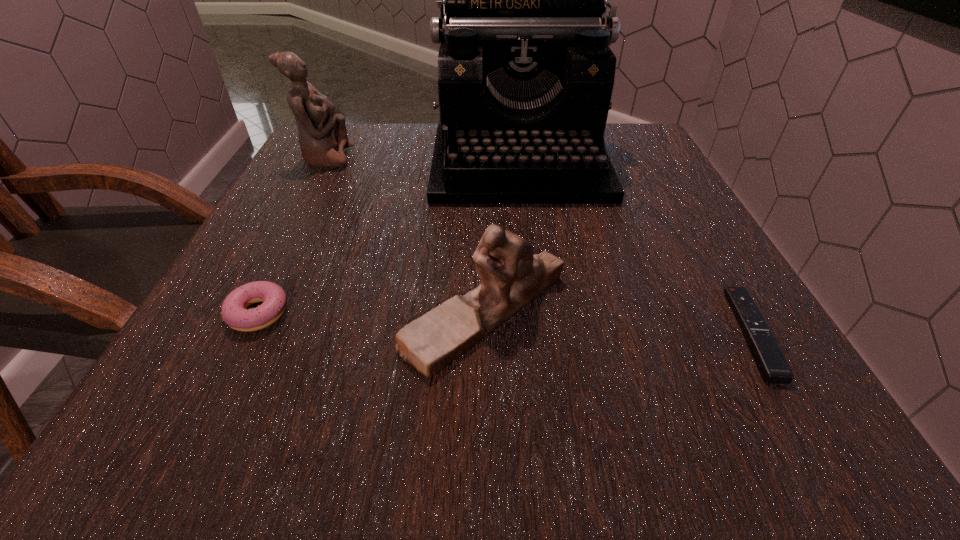
Where is `object that is the closest to the tallest object`? object that is the closest to the tallest object is located at coordinates (511, 276).

The width and height of the screenshot is (960, 540). I want to click on vacant space that satisfies the following two spatial constraints: 1. on the front-facing side of the taller figurine; 2. on the back side of the remote control, so click(232, 333).

This screenshot has height=540, width=960. Identify the location of blank area in the image that satisfies the following two spatial constraints: 1. on the front-facing side of the shorter figurine; 2. on the right side of the shortest object. (485, 333).

Where is `free spot that satisfies the following two spatial constraints: 1. on the back side of the shortest object; 2. on the front-facing side of the third tallest object`? The image size is (960, 540). free spot that satisfies the following two spatial constraints: 1. on the back side of the shortest object; 2. on the front-facing side of the third tallest object is located at coordinates (740, 312).

Image resolution: width=960 pixels, height=540 pixels. I want to click on vacant area that satisfies the following two spatial constraints: 1. on the front-facing side of the doughnut; 2. on the left side of the farther figurine, so click(243, 313).

Where is `free point that satisfies the following two spatial constraints: 1. on the front-facing side of the taller figurine; 2. on the back side of the fourth tallest object`? free point that satisfies the following two spatial constraints: 1. on the front-facing side of the taller figurine; 2. on the back side of the fourth tallest object is located at coordinates click(x=243, y=313).

This screenshot has height=540, width=960. Identify the location of free point that satisfies the following two spatial constraints: 1. on the front-facing side of the rightmost object; 2. on the left side of the nearer figurine. (485, 333).

Identify the location of vacant space that satisfies the following two spatial constraints: 1. on the front-facing side of the taller figurine; 2. on the left side of the remote control. Image resolution: width=960 pixels, height=540 pixels. (232, 333).

Locate an element on the screen. Image resolution: width=960 pixels, height=540 pixels. vacant space that satisfies the following two spatial constraints: 1. on the front-facing side of the right figurine; 2. on the back side of the remote control is located at coordinates (485, 333).